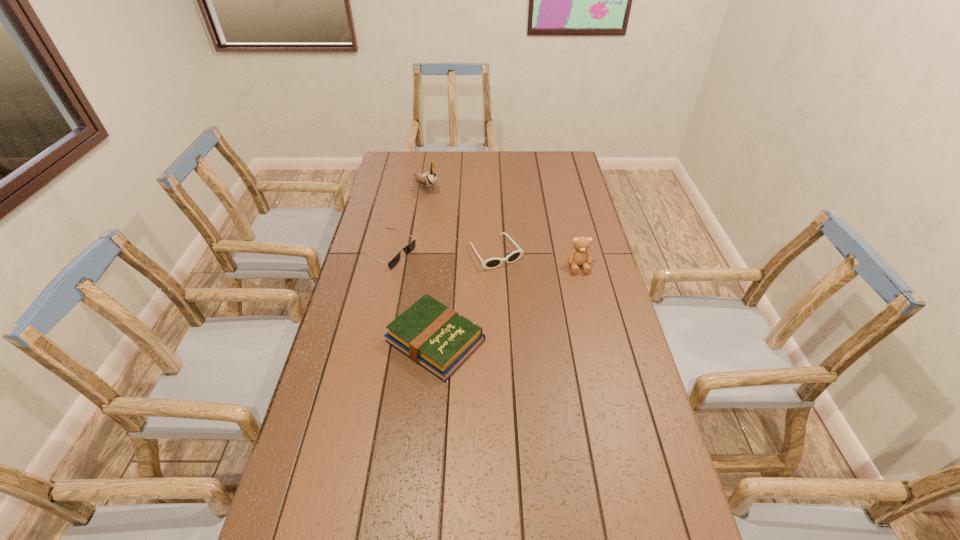
The image size is (960, 540). Identify the location of vacant region located at the face of the farthest object. (443, 208).

The height and width of the screenshot is (540, 960). What are the coordinates of `free location located at the face of the farthest object` in the screenshot? It's located at coord(455,221).

The height and width of the screenshot is (540, 960). Identify the location of vacant area located at the face of the farthest object. (471, 237).

This screenshot has width=960, height=540. I want to click on vacant space located 0.060m on the front-facing side of the left sunglasses, so click(423, 268).

Find the location of a particular element. This screenshot has width=960, height=540. vacant space located 0.210m on the front-facing side of the left sunglasses is located at coordinates (460, 284).

You are a GUI agent. You are given a task and a screenshot of the screen. Output one action in this format:
    pyautogui.click(x=<x>, y=<y>)
    Task: Click on the vacant space located 0.270m on the front-facing side of the left sunglasses
    Image resolution: width=960 pixels, height=540 pixels.
    Given the screenshot: What is the action you would take?
    pyautogui.click(x=474, y=291)

Find the location of a particular element. Image resolution: width=960 pixels, height=540 pixels. free region located 0.060m with the lenses of the right sunglasses facing outward is located at coordinates (516, 280).

You are a GUI agent. You are given a task and a screenshot of the screen. Output one action in this format:
    pyautogui.click(x=<x>, y=<y>)
    Task: Click on the blank space located 0.340m with the lenses of the right sunglasses facing outward
    
    Given the screenshot: What is the action you would take?
    pyautogui.click(x=560, y=340)

At what (x,y) coordinates should I click in order to perform the action: click on vacant point located with the lenses of the right sunglasses facing outward. Please return your answer as a coordinate pair (x, y). This screenshot has width=960, height=540. Looking at the image, I should click on (546, 321).

You are a GUI agent. You are given a task and a screenshot of the screen. Output one action in this format:
    pyautogui.click(x=<x>, y=<y>)
    Task: Click on the object present at the far edge
    
    Given the screenshot: What is the action you would take?
    pyautogui.click(x=429, y=179)